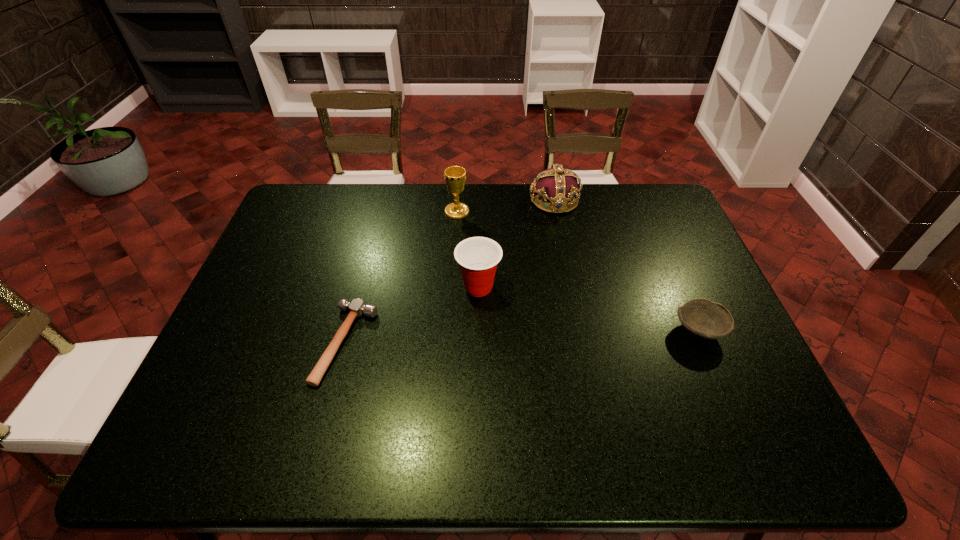
Find the location of `object that is the fourth closest to the third farthest object`. object that is the fourth closest to the third farthest object is located at coordinates (702, 318).

This screenshot has width=960, height=540. In order to click on vacant area that satisfies the following two spatial constraints: 1. on the back side of the crown; 2. on the left side of the shortest object in this screenshot , I will do `click(382, 200)`.

Locate an element on the screen. blank space that satisfies the following two spatial constraints: 1. on the back side of the shortest object; 2. on the left side of the third nearest object is located at coordinates (360, 287).

At what (x,y) coordinates should I click in order to perform the action: click on free location that satisfies the following two spatial constraints: 1. on the back side of the chalice; 2. on the right side of the second object from right to left. Please return your answer as a coordinate pair (x, y). The width and height of the screenshot is (960, 540). Looking at the image, I should click on (458, 200).